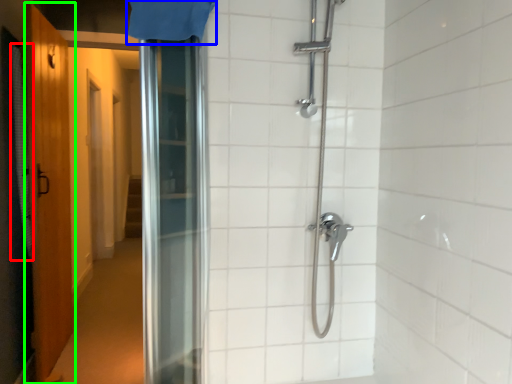
Question: Which object is the closest to the shower curtain (highlighted by a red box)? Choose among these: shower curtain (highlighted by a blue box) or door (highlighted by a green box).

Choices:
 (A) shower curtain
 (B) door

Answer: (B)